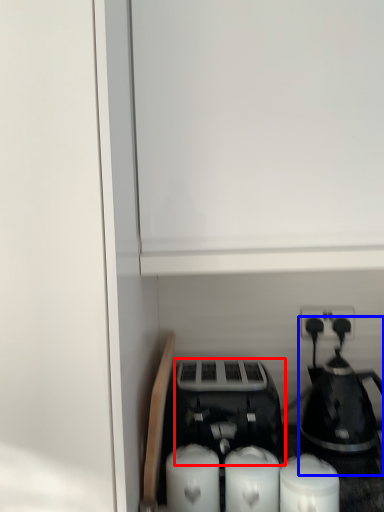
Question: Which object appears closest to the camera in this image, toaster (highlighted by a red box) or coffee maker (highlighted by a blue box)?

Choices:
 (A) toaster
 (B) coffee maker

Answer: (A)